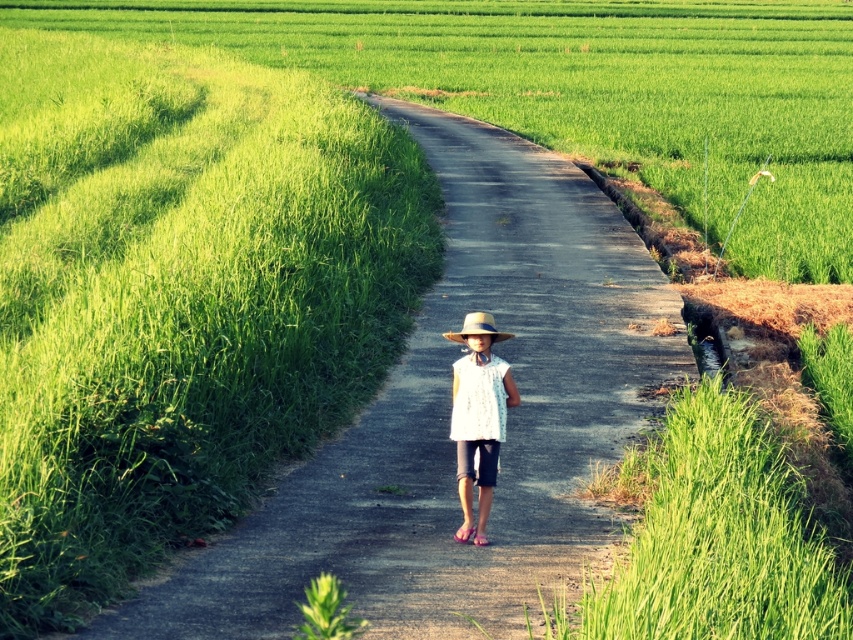
Question: Can you confirm if dirt road at center is smaller than white lace dress at center?

Choices:
 (A) yes
 (B) no

Answer: (B)

Question: Which point appears farthest from the camera in this image?

Choices:
 (A) (479, 419)
 (B) (428, 483)
 (C) (469, 317)

Answer: (B)

Question: Which point is closer to the camera?

Choices:
 (A) natural straw hat at center
 (B) dirt road at center

Answer: (B)

Question: Which point is closer to the camera taking this photo?

Choices:
 (A) (479, 324)
 (B) (474, 342)
 (C) (517, 336)

Answer: (A)

Question: Can you confirm if dirt road at center is wider than white lace dress at center?

Choices:
 (A) no
 (B) yes

Answer: (B)

Question: Can you confirm if dirt road at center is positioned to the right of natural straw hat at center?

Choices:
 (A) yes
 (B) no

Answer: (A)